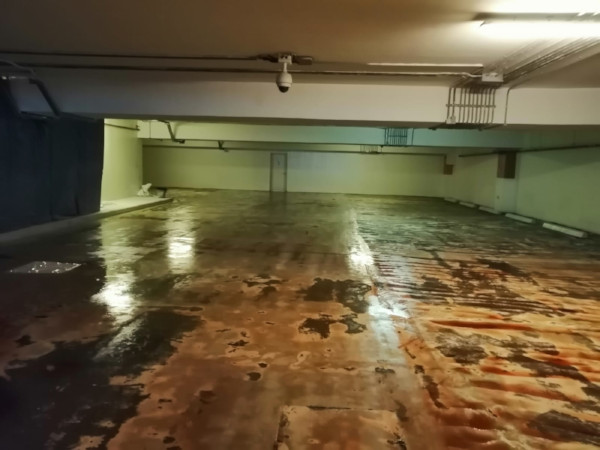
Find the location of a particular element. white wall with light green glow on it is located at coordinates (568, 178).